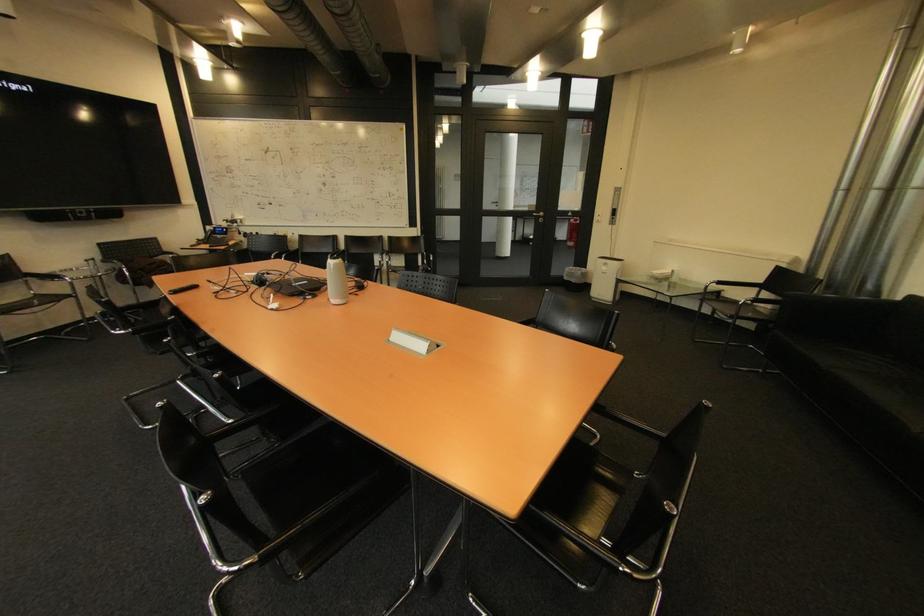
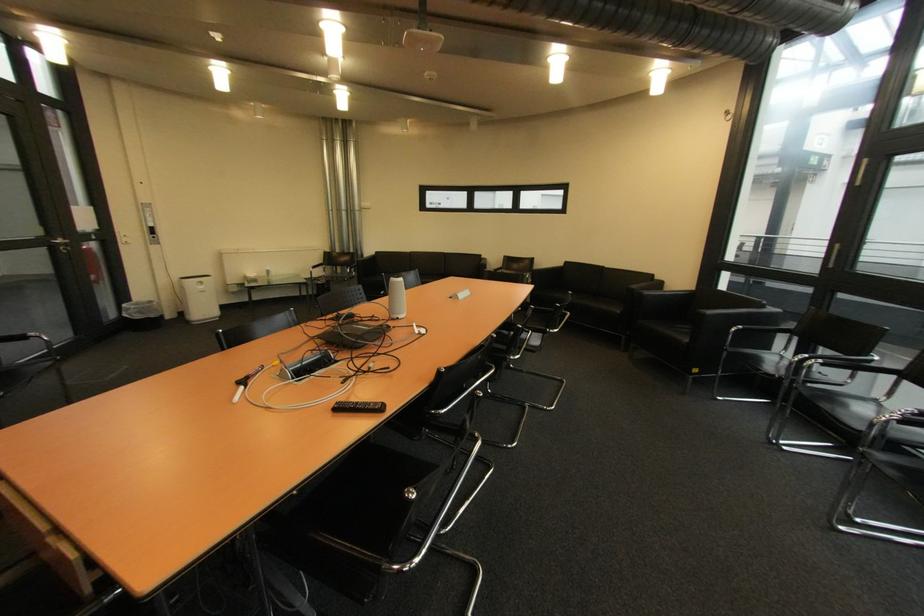
Find the pixel in the second image that matches pixel 613 270 in the first image.

(209, 288)